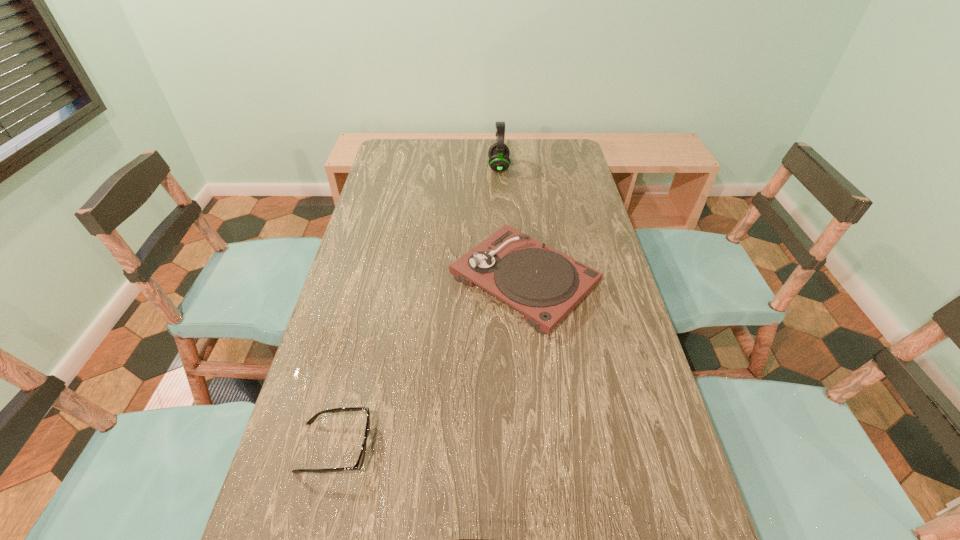
I want to click on the tallest object, so click(498, 153).

In order to click on headset in this screenshot , I will do `click(498, 153)`.

Identify the location of the third nearest object. (545, 285).

Where is `the third shortest object`? the third shortest object is located at coordinates (545, 285).

Find the location of a particular element. Image resolution: width=960 pixels, height=540 pixels. the farther spectacles is located at coordinates tap(360, 461).

Find the location of `the left spectacles`. the left spectacles is located at coordinates (360, 461).

Find the location of a particular element. vacant area located 0.290m on the ear cups of the farthest object is located at coordinates (415, 167).

I want to click on vacant space located on the ear cups of the farthest object, so click(437, 167).

Locate an element on the screen. The image size is (960, 540). vacant space located on the ear cups of the farthest object is located at coordinates (466, 167).

In order to click on vacant area located 0.230m on the front of the phonograph_record in this screenshot , I will do `click(540, 422)`.